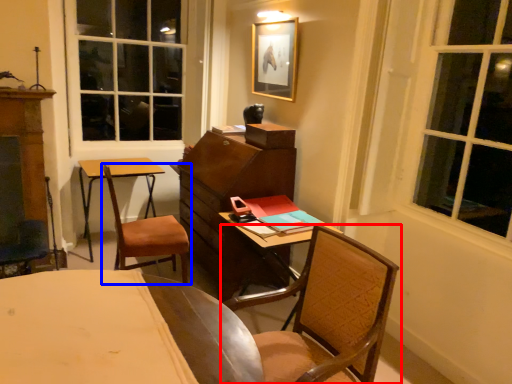
Question: Which object appears closest to the camera in this image, chair (highlighted by a red box) or chair (highlighted by a blue box)?

Choices:
 (A) chair
 (B) chair

Answer: (A)